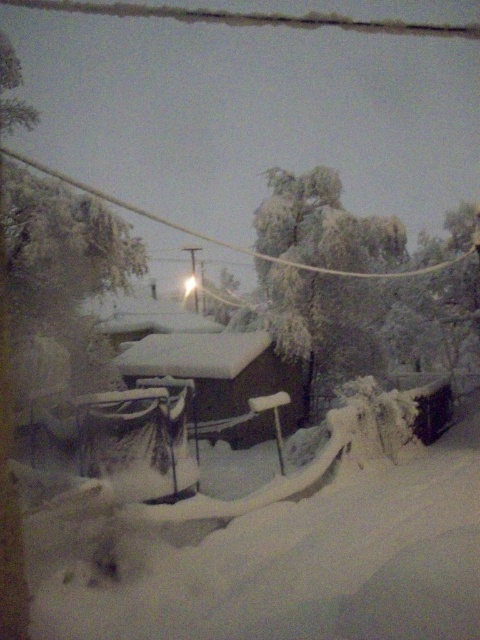
Question: Observing the image, what is the correct spatial positioning of frosted green tree at center in reference to white snow-covered hut at center?

Choices:
 (A) right
 (B) left

Answer: (A)

Question: Is the position of frosted green tree at center more distant than that of white snow-covered hut at center?

Choices:
 (A) no
 (B) yes

Answer: (B)

Question: Which point is farther from the camera taking this photo?

Choices:
 (A) (297, 176)
 (B) (268, 435)

Answer: (A)

Question: Can you confirm if frosted green tree at center is positioned to the left of white snow-covered hut at center?

Choices:
 (A) no
 (B) yes

Answer: (A)